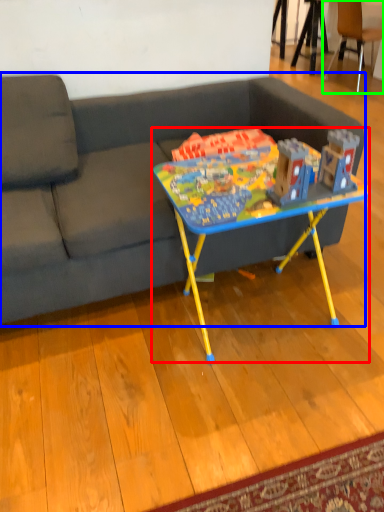
Question: Which object is the farthest from table (highlighted by a red box)? Choose among these: studio couch (highlighted by a blue box) or chair (highlighted by a green box).

Choices:
 (A) studio couch
 (B) chair

Answer: (B)